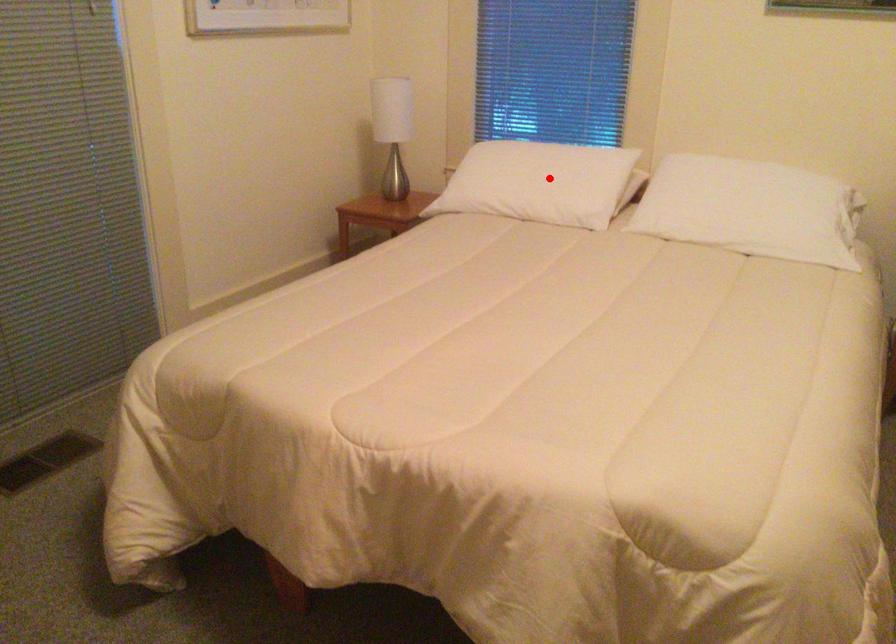
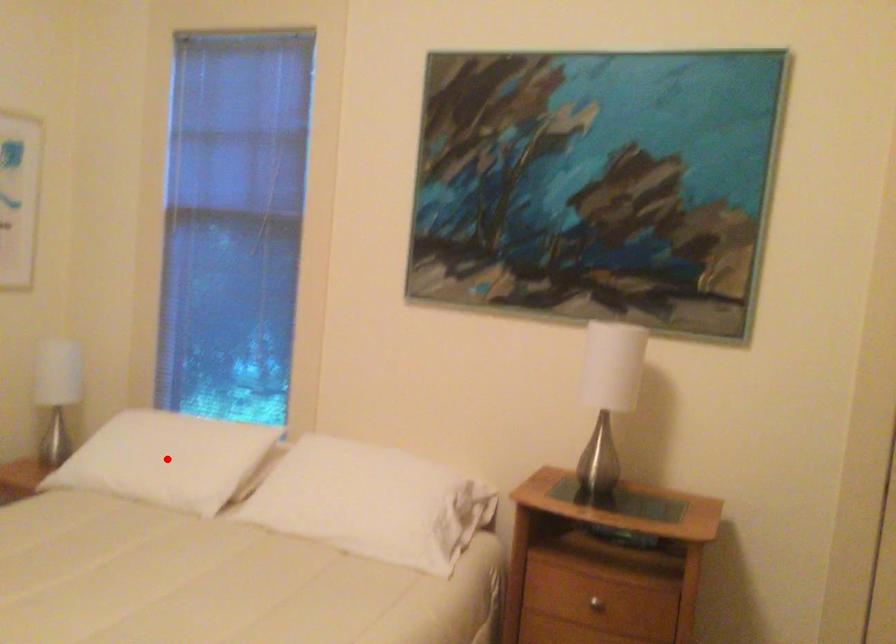
I am providing you with two images of the same scene from different viewpoints. A red point is marked on the first image and another point is marked on the second image. Is the red point in image1 aligned with the point shown in image2?

Yes